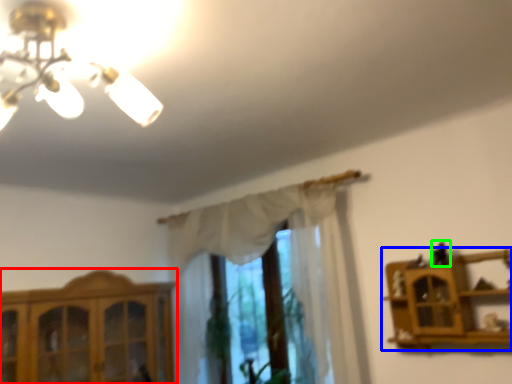
Question: Based on their relative distances, which object is nearer to cabinetry (highlighted by a red box)? Choose from shelf (highlighted by a blue box) and toy (highlighted by a green box).

Choices:
 (A) shelf
 (B) toy

Answer: (A)